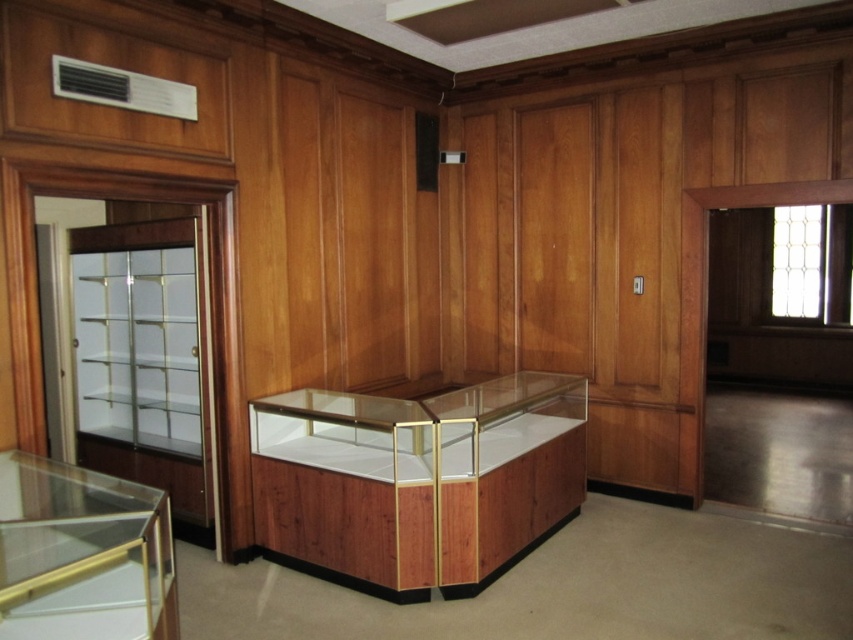
Between wooden display case at center and transparent glass case at lower left, which one is positioned higher?

transparent glass case at lower left is above.

Between point (292, 476) and point (132, 500), which one is positioned in front?

Point (132, 500) is more forward.

Where is `wooden display case at center`? This screenshot has height=640, width=853. wooden display case at center is located at coordinates (418, 480).